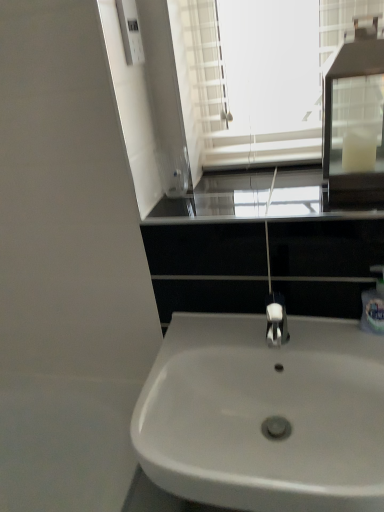
Find the location of `vacant position to the left of white glass medicine cabinet at upper right`. vacant position to the left of white glass medicine cabinet at upper right is located at coordinates (278, 186).